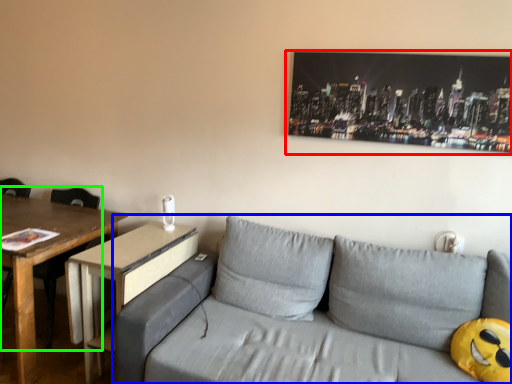
Question: Considering the real-world distances, which object is farthest from picture frame (highlighted by a red box)? studio couch (highlighted by a blue box) or chair (highlighted by a green box)?

Choices:
 (A) studio couch
 (B) chair

Answer: (B)